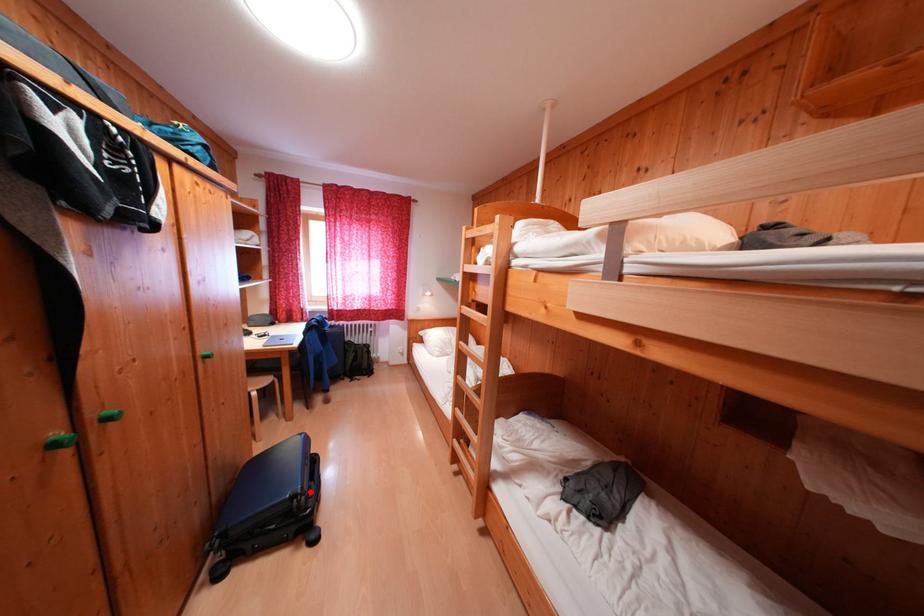
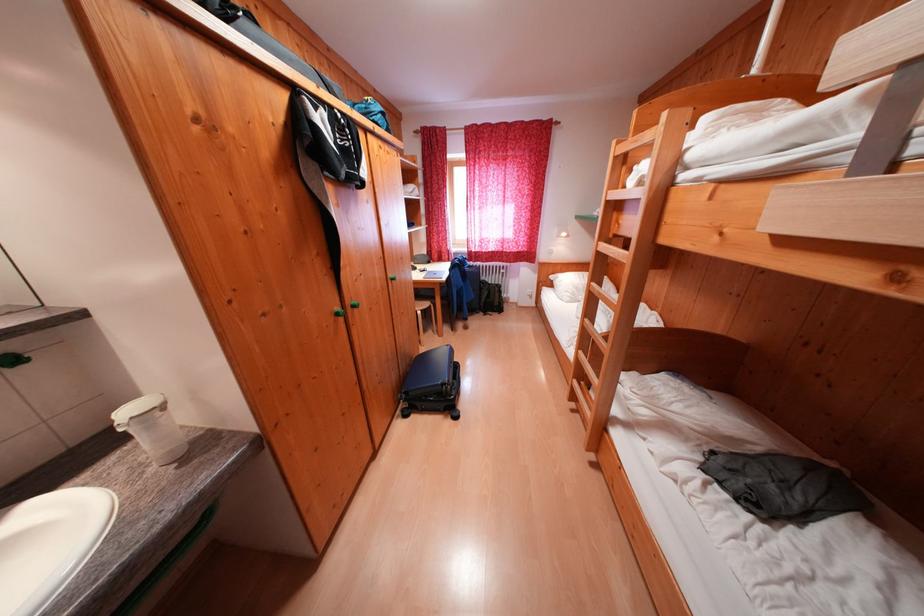
The point at the highlighted location is marked in the first image. Where is the corresponding point in the second image?

(456, 384)